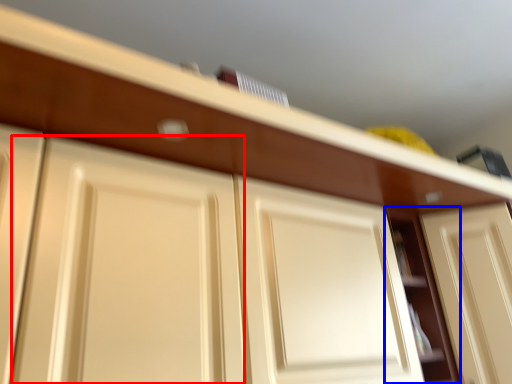
Question: Which object appears closest to the camera in this image, door (highlighted by a red box) or cabinet (highlighted by a blue box)?

Choices:
 (A) door
 (B) cabinet

Answer: (A)